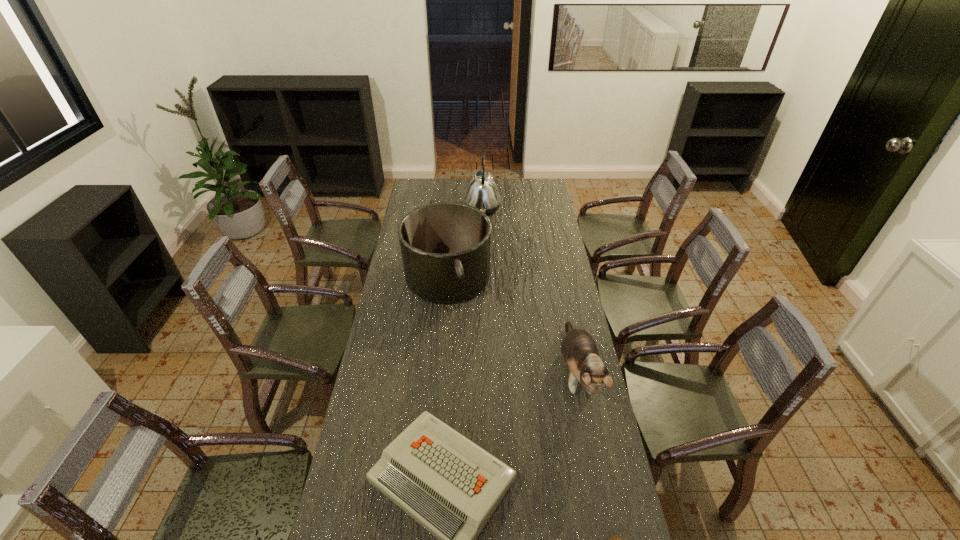
I want to click on kettle, so click(x=482, y=193).

Where is `the second farthest object`? The image size is (960, 540). the second farthest object is located at coordinates (445, 247).

Where is `cat`? The height and width of the screenshot is (540, 960). cat is located at coordinates (579, 350).

Locate an element on the screen. blank space located 0.130m from the spout of the kettle is located at coordinates (442, 207).

Identify the location of free space located from the spout of the kettle. (413, 207).

You are a GUI agent. You are given a task and a screenshot of the screen. Output one action in this format:
    pyautogui.click(x=<x>, y=<y>)
    Task: Click on the vacant area situated from the spout of the kettle
    
    Given the screenshot: What is the action you would take?
    pyautogui.click(x=420, y=207)

The image size is (960, 540). I want to click on vacant position located 0.300m on the front of the second farthest object, so click(439, 380).

I want to click on free region located at the face of the cat, so click(x=593, y=458).

Find the location of `object at the far edge`. object at the far edge is located at coordinates (482, 193).

Image resolution: width=960 pixels, height=540 pixels. I want to click on object situated at the left edge, so click(445, 247).